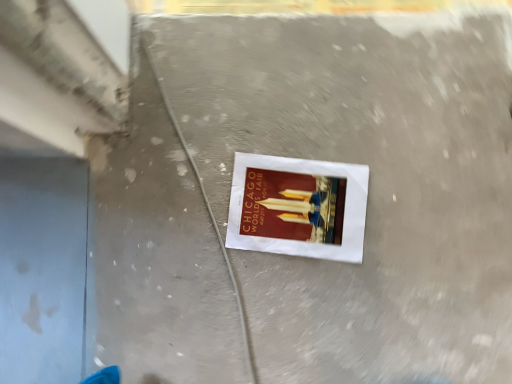
This screenshot has height=384, width=512. Find the location of `vacant area on the back side of white paper poster at center`. vacant area on the back side of white paper poster at center is located at coordinates (315, 136).